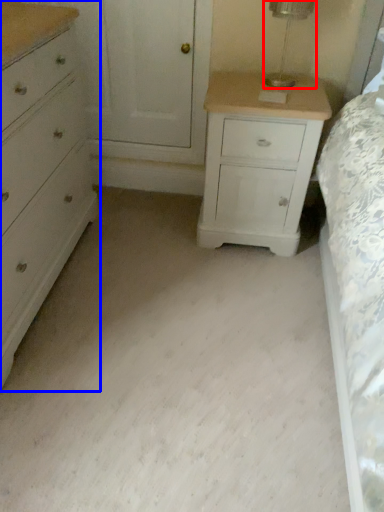
Question: Which object is further to the camera taking this photo, table lamp (highlighted by a red box) or chest of drawers (highlighted by a blue box)?

Choices:
 (A) table lamp
 (B) chest of drawers

Answer: (A)